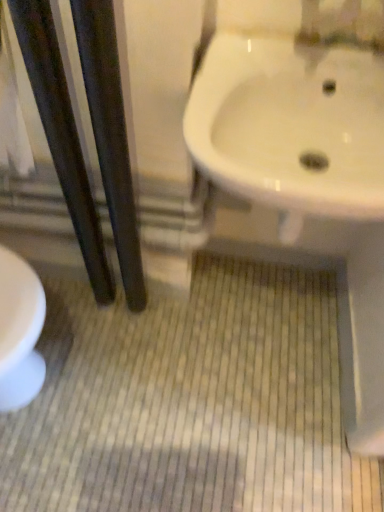
You are a GUI agent. You are given a task and a screenshot of the screen. Output one action in this format:
    pyautogui.click(x=<x>, y=<y>)
    Task: Click on the vacant area situated below white glossy sink at upper right (from a real-world perspective)
    The image size is (384, 512).
    Given the screenshot: What is the action you would take?
    pyautogui.click(x=246, y=306)